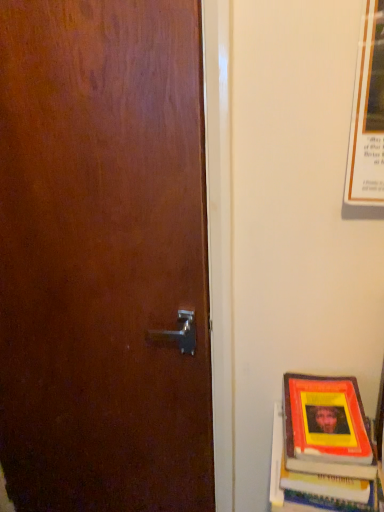
Question: From the image's perspective, is matte paper poster at upper right below yellow matte book at lower right?

Choices:
 (A) no
 (B) yes

Answer: (A)

Question: Is matte paper poster at upper right facing towards yellow matte book at lower right?

Choices:
 (A) no
 (B) yes

Answer: (A)

Question: Is matte paper poster at upper right to the left of yellow matte book at lower right from the viewer's perspective?

Choices:
 (A) yes
 (B) no

Answer: (B)

Question: From the image's perspective, is matte paper poster at upper right on top of yellow matte book at lower right?

Choices:
 (A) yes
 (B) no

Answer: (A)

Question: Does matte paper poster at upper right have a lesser width compared to yellow matte book at lower right?

Choices:
 (A) yes
 (B) no

Answer: (A)

Question: Does matte paper poster at upper right contain yellow matte book at lower right?

Choices:
 (A) no
 (B) yes

Answer: (A)

Question: Does yellow matte book at lower right touch matte paper poster at upper right?

Choices:
 (A) yes
 (B) no

Answer: (B)

Question: Considering the relative sizes of yellow matte book at lower right and matte paper poster at upper right in the image provided, is yellow matte book at lower right bigger than matte paper poster at upper right?

Choices:
 (A) no
 (B) yes

Answer: (B)

Question: Is yellow matte book at lower right wider than matte paper poster at upper right?

Choices:
 (A) yes
 (B) no

Answer: (A)

Question: From a real-world perspective, is yellow matte book at lower right on top of matte paper poster at upper right?

Choices:
 (A) yes
 (B) no

Answer: (B)

Question: From a real-world perspective, is yellow matte book at lower right located beneath matte paper poster at upper right?

Choices:
 (A) no
 (B) yes

Answer: (B)

Question: Is yellow matte book at lower right outside matte paper poster at upper right?

Choices:
 (A) no
 (B) yes

Answer: (B)

Question: Looking at the image, does matte paper poster at upper right seem bigger or smaller compared to yellow matte book at lower right?

Choices:
 (A) big
 (B) small

Answer: (B)